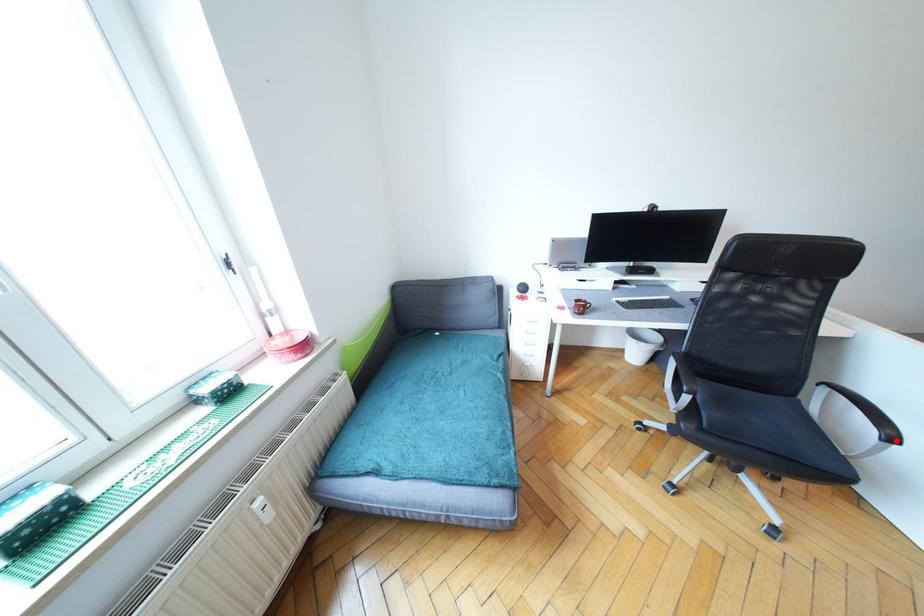
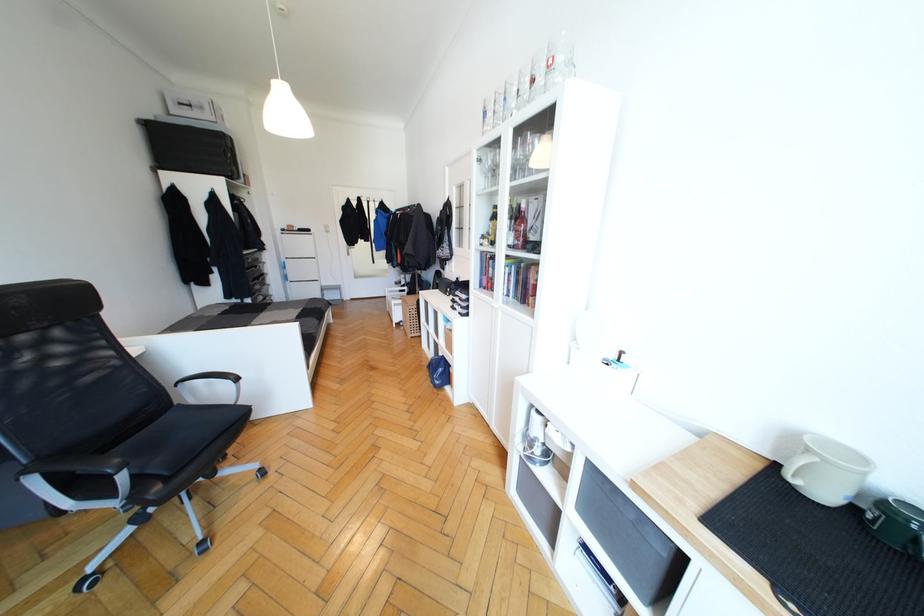
Find the pixel in the second image that matches the highlighted location in the first image.

(239, 379)